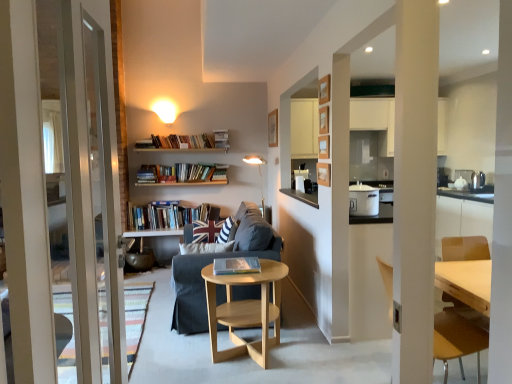
Question: Is the depth of light brown wooden chair at right less than that of white glossy pot at center-right, the second appliance viewed from the back?

Choices:
 (A) no
 (B) yes

Answer: (B)

Question: Is light brown wooden chair at right next to white glossy pot at center-right, arranged as the 2th appliance when viewed from the right?

Choices:
 (A) no
 (B) yes

Answer: (A)

Question: From a real-world perspective, is light brown wooden chair at right over white glossy pot at center-right, marked as the 1th appliance in a front-to-back arrangement?

Choices:
 (A) no
 (B) yes

Answer: (A)

Question: Is light brown wooden chair at right at the right side of white glossy pot at center-right, arranged as the 2th appliance when viewed from the right?

Choices:
 (A) no
 (B) yes

Answer: (B)

Question: Is light brown wooden chair at right at the left side of white glossy pot at center-right, marked as the 1th appliance in a front-to-back arrangement?

Choices:
 (A) yes
 (B) no

Answer: (B)

Question: Is white glossy pot at center-right, marked as the 1th appliance in a left-to-right arrangement, completely or partially inside light brown wooden chair at right?

Choices:
 (A) yes
 (B) no

Answer: (B)

Question: Can you confirm if gold metallic floor lamp at center is positioned to the right of light wood/woodenobject at center?

Choices:
 (A) no
 (B) yes

Answer: (B)

Question: Is gold metallic floor lamp at center far away from light wood/woodenobject at center?

Choices:
 (A) yes
 (B) no

Answer: (A)

Question: Is gold metallic floor lamp at center looking in the opposite direction of light wood/woodenobject at center?

Choices:
 (A) yes
 (B) no

Answer: (B)

Question: Is gold metallic floor lamp at center taller than light wood/woodenobject at center?

Choices:
 (A) no
 (B) yes

Answer: (B)

Question: Does gold metallic floor lamp at center have a lesser height compared to light wood/woodenobject at center?

Choices:
 (A) yes
 (B) no

Answer: (B)

Question: Is gold metallic floor lamp at center thinner than light wood/woodenobject at center?

Choices:
 (A) yes
 (B) no

Answer: (A)

Question: Would you say dark gray fabric couch at center is outside striped fabric pillow at center?

Choices:
 (A) no
 (B) yes

Answer: (B)